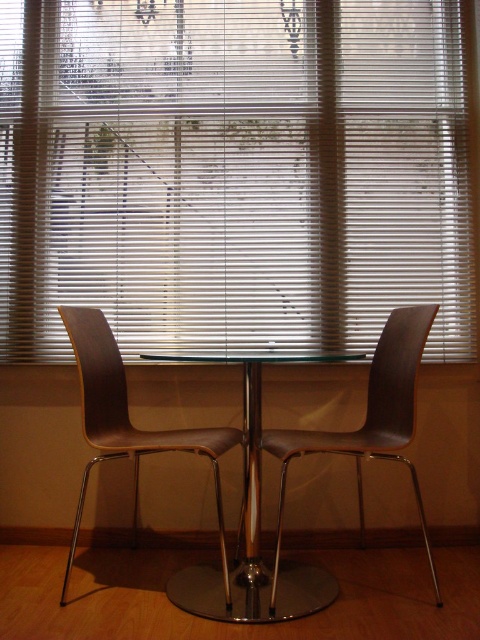
You are sitting in the matte wood swivel chair at left and want to look out the window. Can you see the white matte blinds at center from your current position?

Yes, the matte wood swivel chair at left is behind the white matte blinds at center, so you can see the white matte blinds at center from your current position.

You are standing in the room and want to move from the point at coordinates point (x=443, y=29) to the point at coordinates point (x=100, y=314). Since you can only move forward, will you be able to reach the second point without turning around?

Point (x=443, y=29) is behind point (x=100, y=314), so yes, you can move forward from point (x=443, y=29) to point (x=100, y=314) without needing to turn around because the second point is in front of the first one from your perspective.

You are sitting in the matte wood swivel chair at left and want to place a book on the clear glass table at center. In which direction should you move your hand to reach the table?

The clear glass table at center is to the right of the matte wood swivel chair at left, so you should move your hand to the right to reach the table.